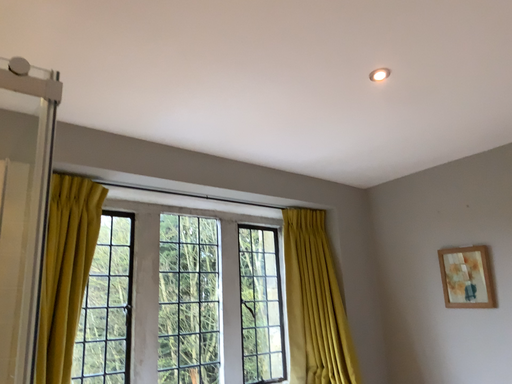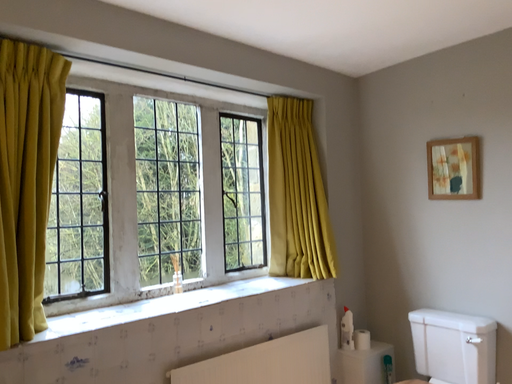
Question: How did the camera likely rotate when shooting the video?

Choices:
 (A) rotated upward
 (B) rotated downward

Answer: (B)